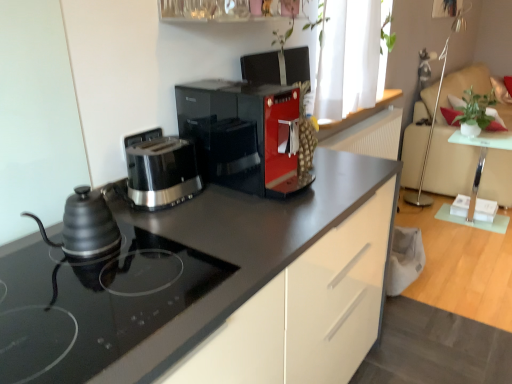
Question: Considering the positions of matte black coffee maker at center and black matte kettle at left in the image, is matte black coffee maker at center bigger or smaller than black matte kettle at left?

Choices:
 (A) big
 (B) small

Answer: (A)

Question: Which is correct: matte black coffee maker at center is inside black matte kettle at left, or outside of it?

Choices:
 (A) inside
 (B) outside

Answer: (B)

Question: Estimate the real-world distances between objects in this image. Which object is farther from the matte black coffee maker at center?

Choices:
 (A) white fabric window at upper right
 (B) green matte plant at upper right
 (C) satin black toaster at left
 (D) white fabric chair at right
 (E) clear glass shelf at upper center

Answer: (D)

Question: Estimate the real-world distances between objects in this image. Which object is farther from the matte black coffee maker at center?

Choices:
 (A) green matte plant at upper right
 (B) white fabric window at upper right
 (C) white fabric chair at right
 (D) matte black kettle at left
 (E) black matte kettle at left

Answer: (C)